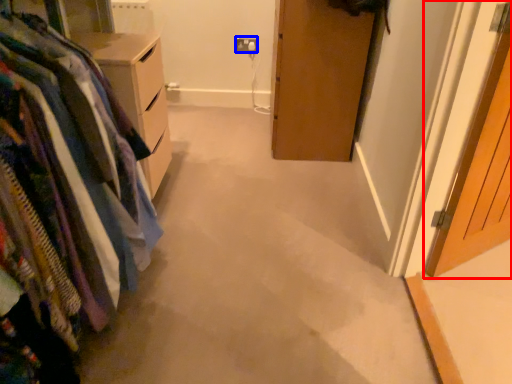
Question: Which object appears farthest to the camera in this image, door (highlighted by a red box) or electric outlet (highlighted by a blue box)?

Choices:
 (A) door
 (B) electric outlet

Answer: (B)